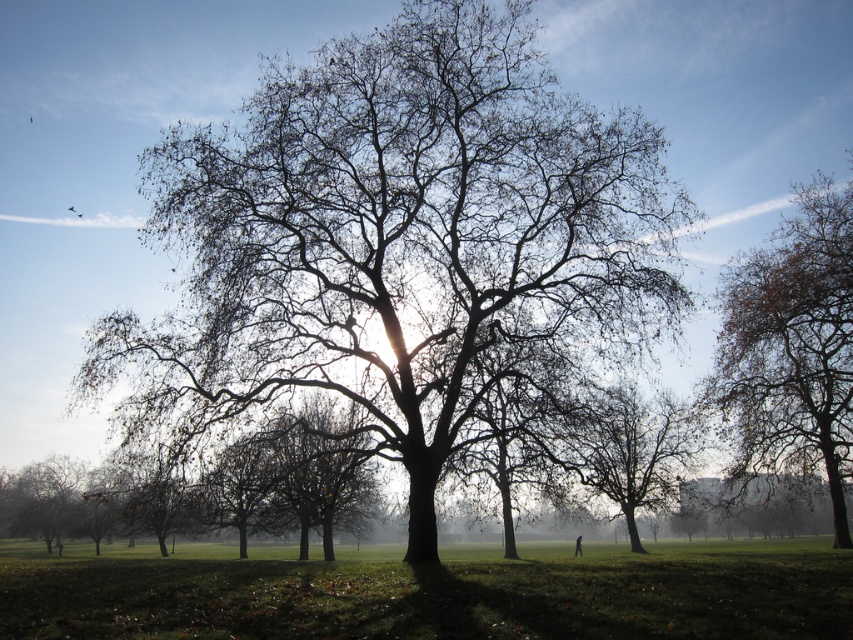
You are standing in the park and see two points marked in the scene. The first point is at coordinates point (318, 419) and the second is at point (648, 483). Which point is closer to you?

Point (318, 419) is in front of point (648, 483), so it is closer to you.